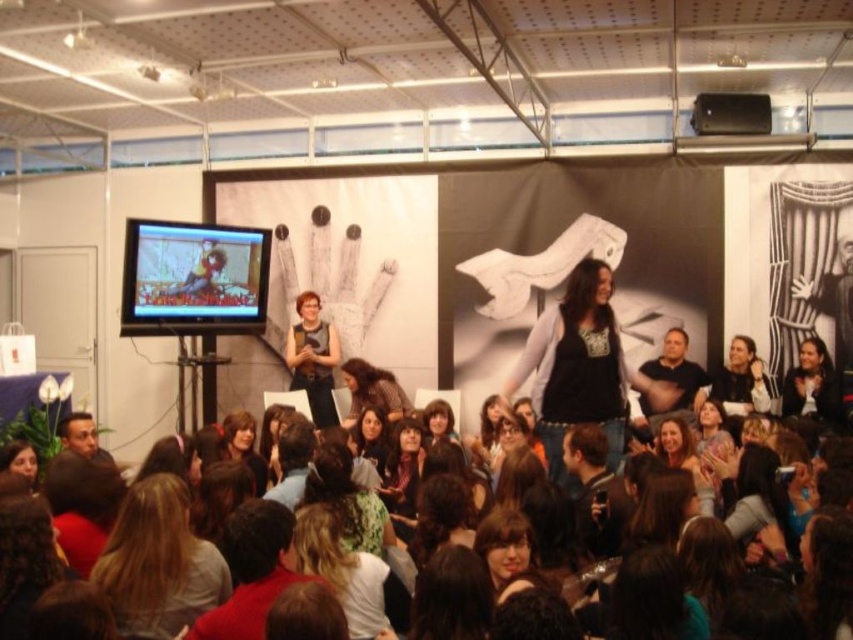
Image resolution: width=853 pixels, height=640 pixels. What do you see at coordinates (576, 368) in the screenshot?
I see `black cotton shirt at center` at bounding box center [576, 368].

From the picture: Does black cotton shirt at center have a greater width compared to matte black dress at center?

Indeed, black cotton shirt at center has a greater width compared to matte black dress at center.

The width and height of the screenshot is (853, 640). Identify the location of black cotton shirt at center. (576, 368).

This screenshot has height=640, width=853. Identify the location of black cotton shirt at center. (576, 368).

Looking at this image, can you confirm if dark brown leather jacket at center is shorter than black matte speaker at upper center?

No, dark brown leather jacket at center is not shorter than black matte speaker at upper center.

Who is more distant from viewer, (x=653, y=401) or (x=747, y=115)?

The point (x=747, y=115) is more distant.

Which is behind, point (676, 353) or point (706, 116)?

The point (676, 353) is more distant.

This screenshot has height=640, width=853. I want to click on dark brown leather jacket at center, so click(x=672, y=380).

Is black cotton shirt at center positioned in front of dark brown hair at lower left?

No, it is behind dark brown hair at lower left.

Is black cotton shirt at center taller than dark brown hair at lower left?

Correct, black cotton shirt at center is much taller as dark brown hair at lower left.

Describe the element at coordinates (576, 368) in the screenshot. I see `black cotton shirt at center` at that location.

The width and height of the screenshot is (853, 640). Identify the location of black cotton shirt at center. point(576,368).